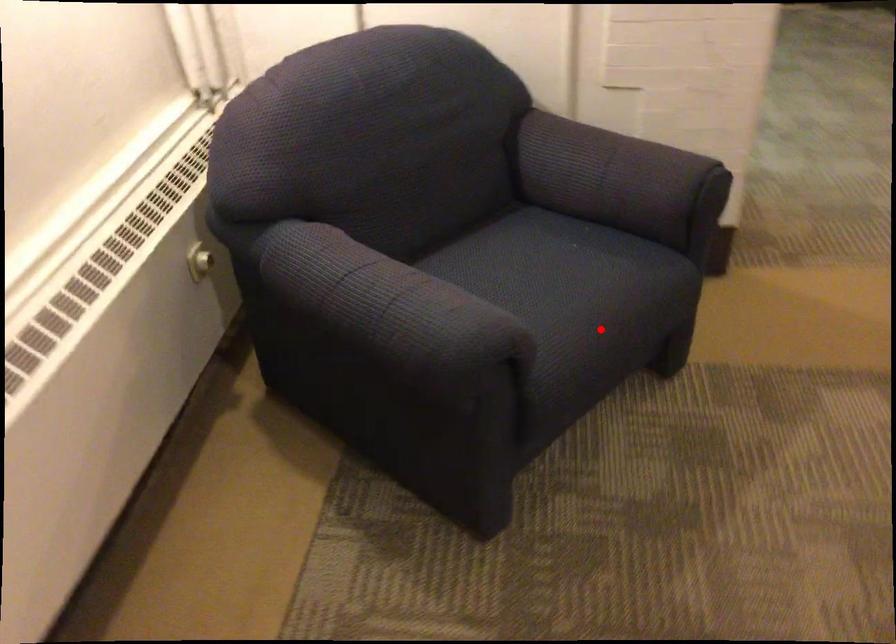
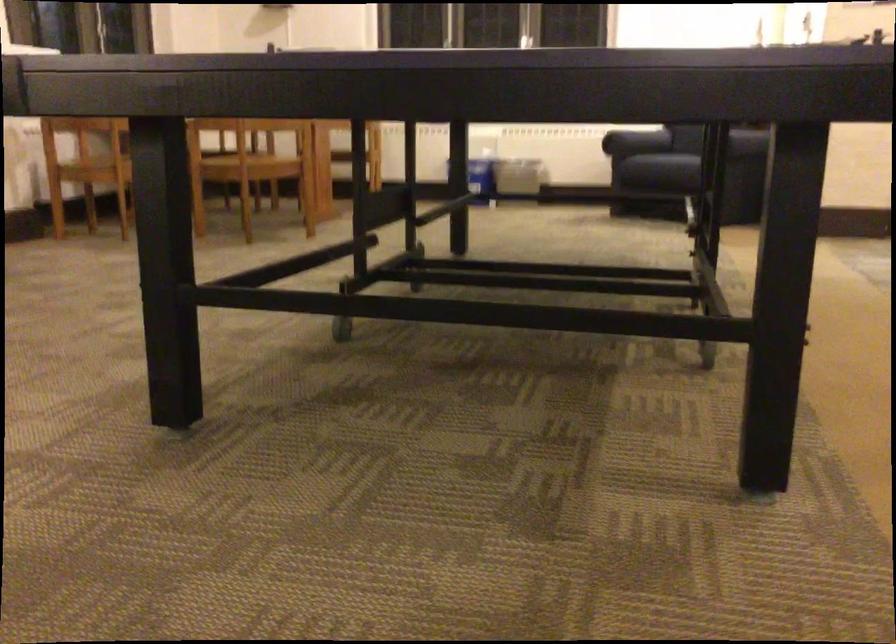
Question: I am providing you with two images of the same scene from different viewpoints. Given a red point in image1, look at the same physical point in image2. Is it:

Choices:
 (A) Closer to the viewpoint
 (B) Farther from the viewpoint

Answer: (B)